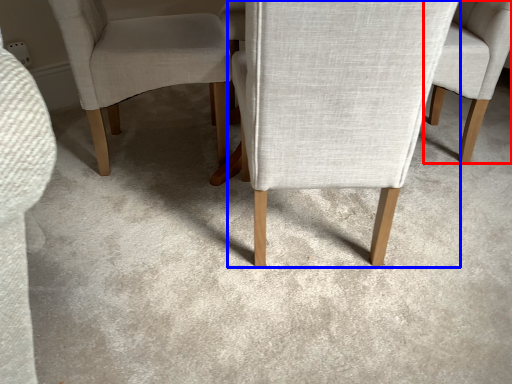
Question: Which point is closer to the camera, chair (highlighted by a red box) or chair (highlighted by a blue box)?

Choices:
 (A) chair
 (B) chair

Answer: (B)